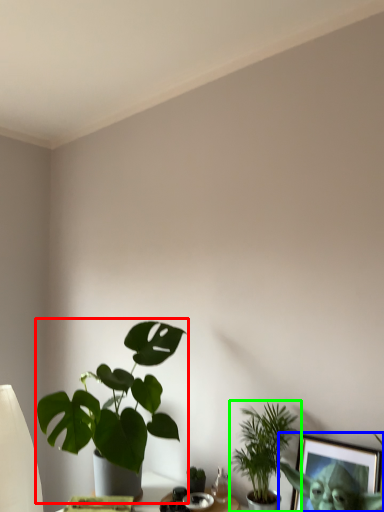
Question: Estimate the real-world distances between objects in this image. Which object is farther from houseplant (highlighted by a red box), picture frame (highlighted by a blue box) or houseplant (highlighted by a green box)?

Choices:
 (A) picture frame
 (B) houseplant

Answer: (A)